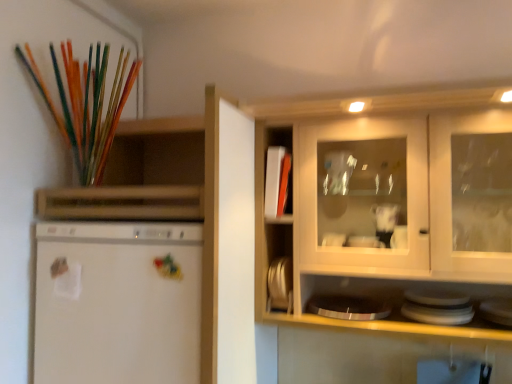
Question: Is white glossy plate at lower right, positioned as the first appliance in right-to-left order, situated inside white matte refrigerator at left or outside?

Choices:
 (A) inside
 (B) outside

Answer: (B)

Question: Considering the positions of white glossy plate at lower right, positioned as the first appliance in right-to-left order, and white matte refrigerator at left in the image, is white glossy plate at lower right, positioned as the first appliance in right-to-left order, taller or shorter than white matte refrigerator at left?

Choices:
 (A) short
 (B) tall

Answer: (A)

Question: Based on their relative distances, which object is nearer to the white matte cabinet at center?

Choices:
 (A) white glossy plate at lower right, acting as the second appliance starting from the left
 (B) translucent glass paint brush at upper left
 (C) metallic silver plates at center, the first appliance when ordered from back to front
 (D) white matte refrigerator at left

Answer: (C)

Question: Estimate the real-world distances between objects in this image. Which object is farther from the white matte cabinet at center?

Choices:
 (A) white glossy plate at lower right, positioned as the first appliance in right-to-left order
 (B) translucent glass paint brush at upper left
 (C) metallic silver plates at center, the second appliance in the right-to-left sequence
 (D) white matte refrigerator at left

Answer: (A)